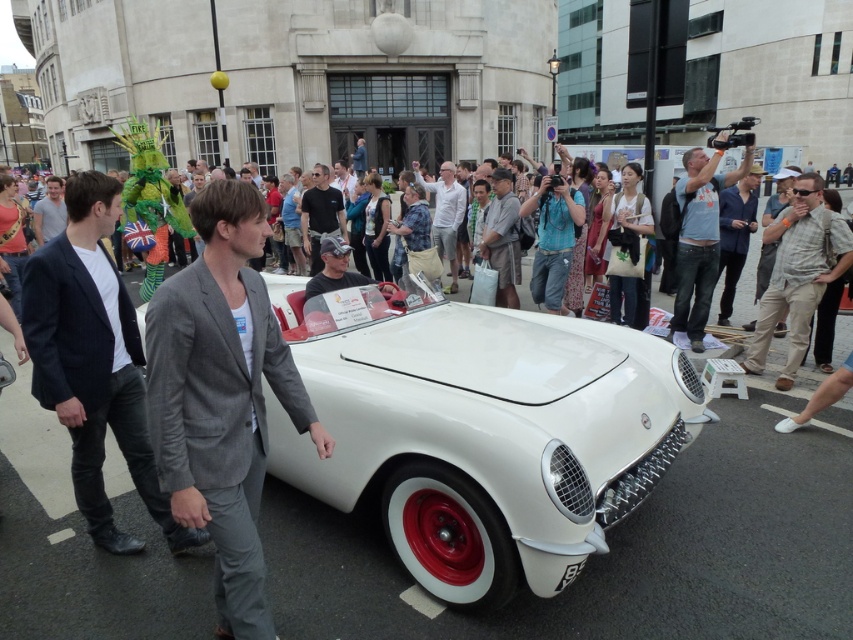
You are a photographer standing at the edge of the street. You want to take a photo that includes both the gray wool blazer at center and the gray cotton shirt at center. If your camera has a maximum focus range of 15 feet, will you be able to capture both subjects clearly in the same frame?

The gray wool blazer at center is 16.48 feet from the gray cotton shirt at center, which exceeds the camera maximum focus range of 15 feet. Therefore, you cannot capture both subjects clearly in the same frame.

You are a tailor who needs to determine which garment requires more fabric to alter. Looking at the gray wool blazer at center and the gray cotton shirt at center, which one would need more fabric for adjustments?

The gray wool blazer at center has a larger size compared to the gray cotton shirt at center, so it would require more fabric for alterations.

You are a photographer standing on the sidewalk and want to capture both the khaki cotton pants at center and the gray suit jacket at left in the same frame. Which object should you focus on first to ensure both are in the frame?

The khaki cotton pants at center is located below the gray suit jacket at left, so you should focus on the gray suit jacket at left first to ensure both are in the frame.